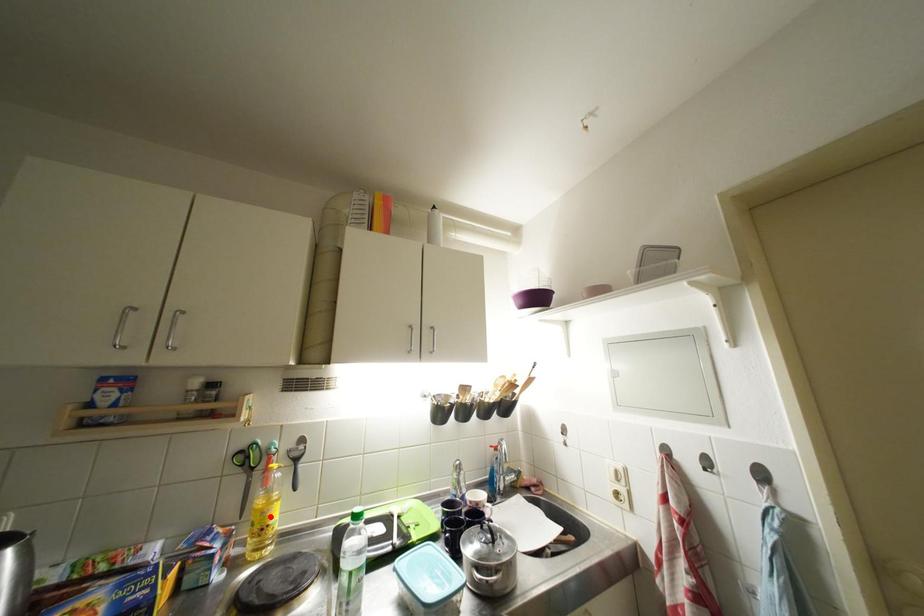
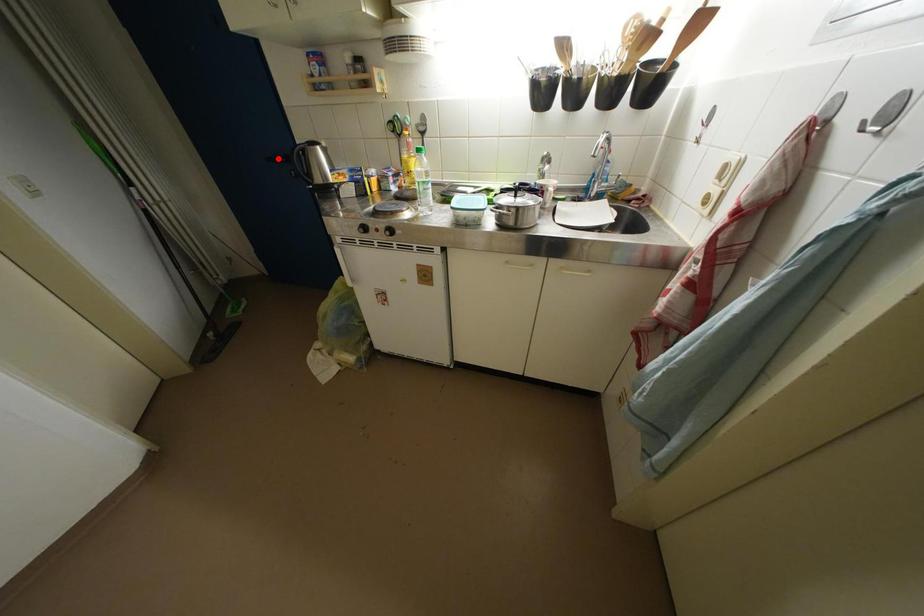
I am providing you with two images of the same scene from different viewpoints. A red point is marked on the first image and another point is marked on the second image. Is the marked point in image1 the same physical position as the marked point in image2?

No